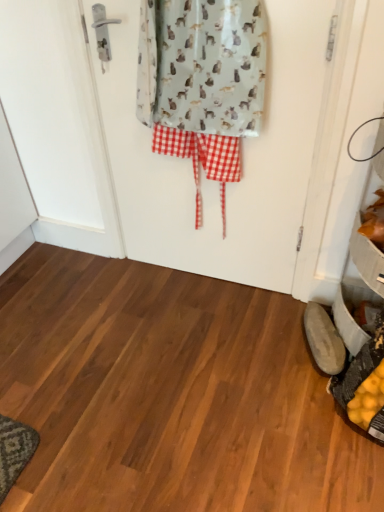
Locate an element on the screen. empty space that is ontop of brown leather shoe at lower right (from a real-world perspective) is located at coordinates (321, 331).